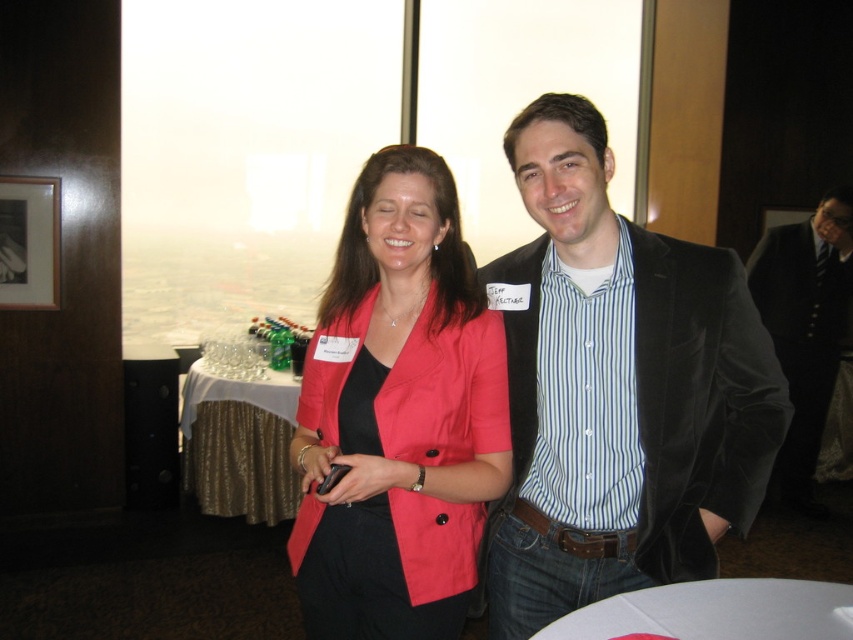
You are standing in front of the two people at the formal event. The point marked at coordinates point (312, 381) is 1.52 meters away from you. If you want to hand a document to both individuals without moving closer than 1.5 meters, which person should you give the document to first?

The point marked at coordinates point (312, 381) is 1.52 meters from viewer, so you can hand the document to the person on the right first since they are closer to you than the other person.

You are an event planner trying to place a new guest in the room. The guest has a black velvet suit at right. Where should you position them relative to the existing attendees?

The black velvet suit at right is located at coordinates point (805, 326), so you should position the new guest near that area to maintain consistency with the existing setup.

You are organizing a photo shoot and need to ensure that the matte red blazer at center and the white glossy table at lower center are visible in the frame. Given that the camera has a limited field of view, which object should you prioritize positioning closer to the camera to ensure both are fully captured?

The matte red blazer at center has a lesser width compared to the white glossy table at lower center, so you should prioritize positioning the white glossy table at lower center closer to the camera since it is wider and might require more space in the frame to be fully captured.